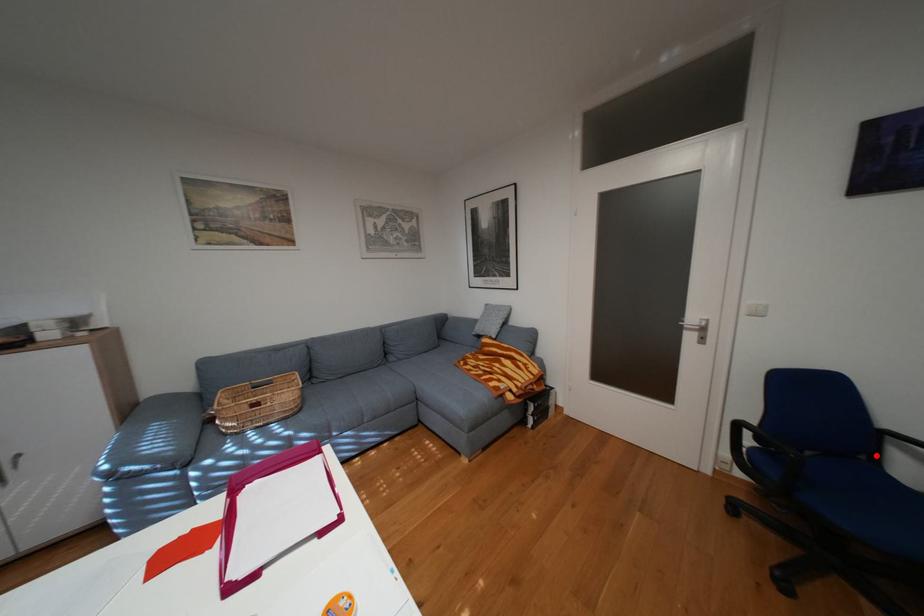
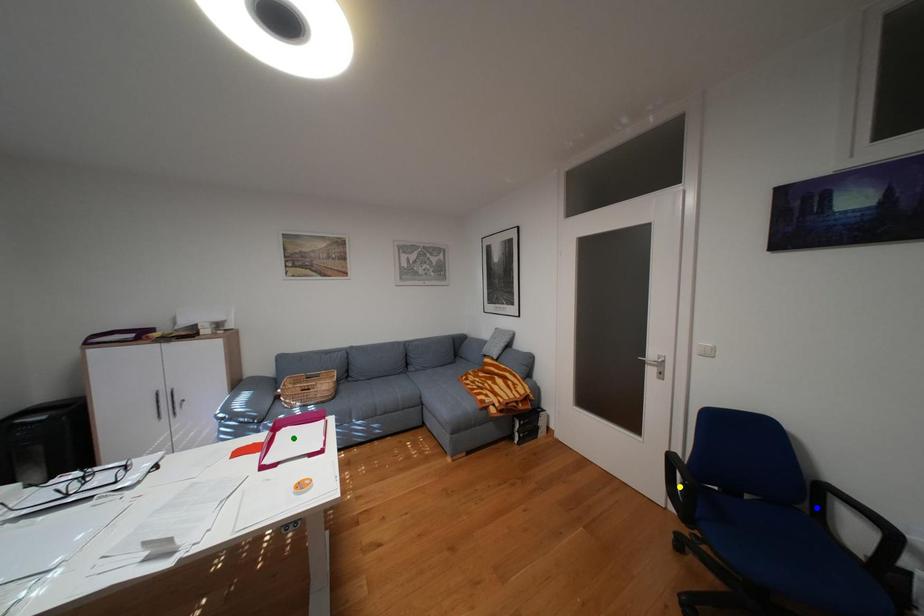
Question: I am providing you with two images of the same scene from different viewpoints. A red point is marked on the first image. You are given multiple points on the second image. Can you choose the point in image 2 that corresponds to the point in image 1?

Choices:
 (A) blue point
 (B) yellow point
 (C) green point

Answer: (A)